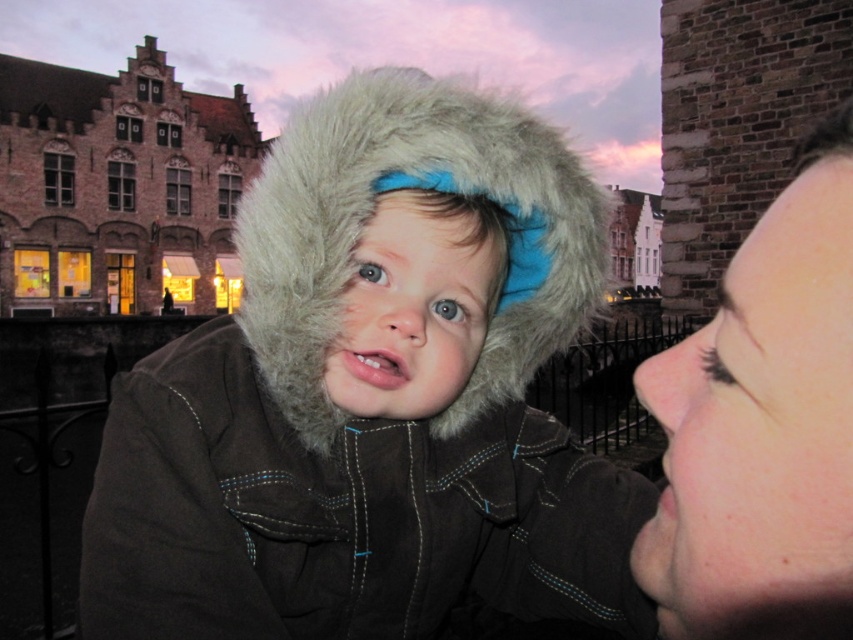
Question: Does fuzzy brown coat at center appear on the right side of smooth skin face at upper right?

Choices:
 (A) yes
 (B) no

Answer: (B)

Question: Can you confirm if fuzzy brown coat at center is positioned to the left of smooth skin face at upper right?

Choices:
 (A) no
 (B) yes

Answer: (B)

Question: Does fuzzy brown coat at center appear on the left side of smooth skin face at upper right?

Choices:
 (A) no
 (B) yes

Answer: (B)

Question: Which object is the closest to the fuzzy brown coat at center?

Choices:
 (A) fuzzy fur hood at center
 (B) smooth skin face at upper right

Answer: (A)

Question: Estimate the real-world distances between objects in this image. Which object is closer to the smooth skin face at upper right?

Choices:
 (A) fuzzy fur hood at center
 (B) fuzzy brown coat at center

Answer: (B)

Question: Which point appears closest to the camera in this image?

Choices:
 (A) (322, 237)
 (B) (442, 560)
 (C) (746, 241)

Answer: (C)